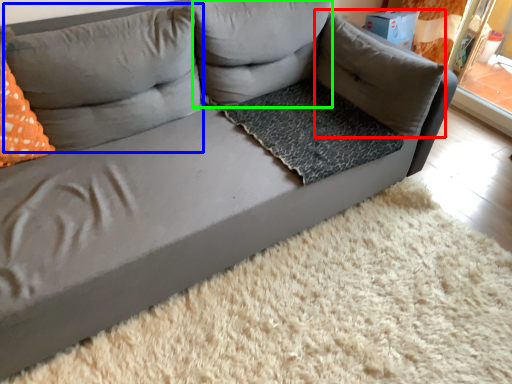
Question: Which is nearer to the pillow (highlighted by a red box)? pillow (highlighted by a blue box) or pillow (highlighted by a green box).

Choices:
 (A) pillow
 (B) pillow

Answer: (B)